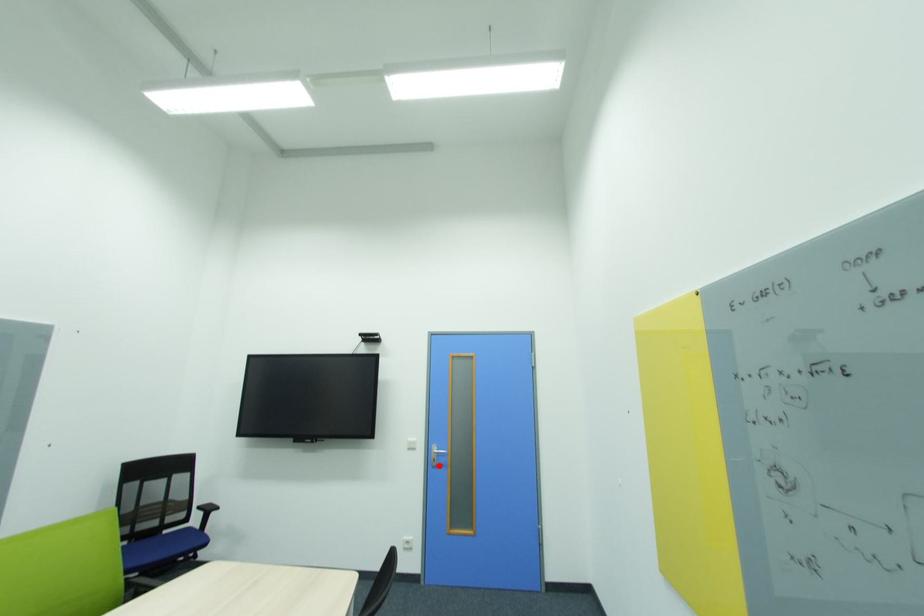
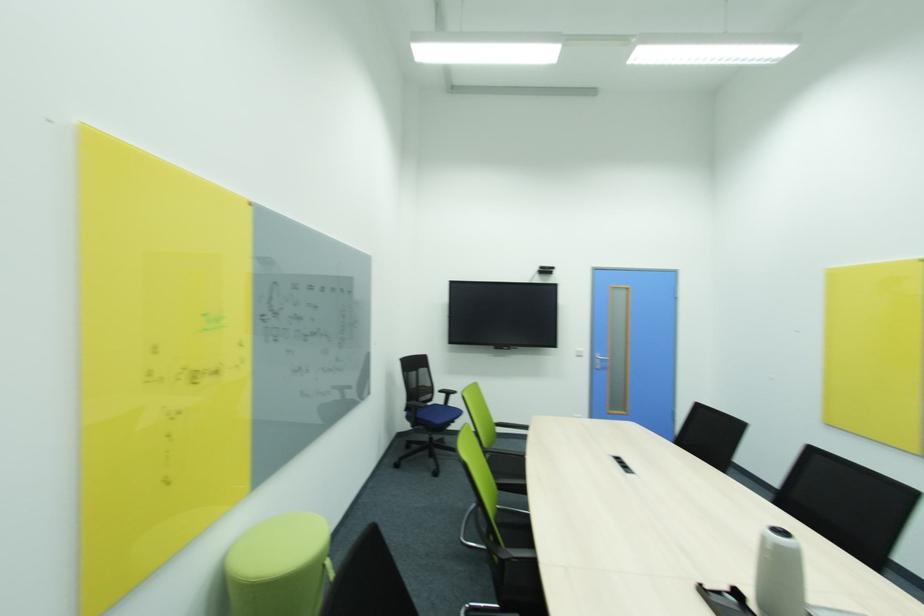
Where in the second image is the point corresponding to the highlighted location from the first image?

(602, 368)